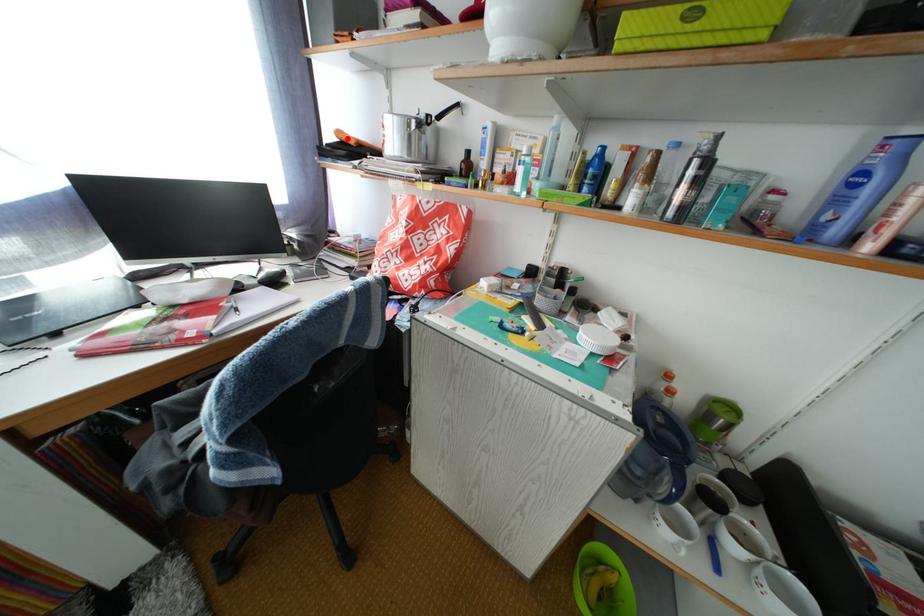
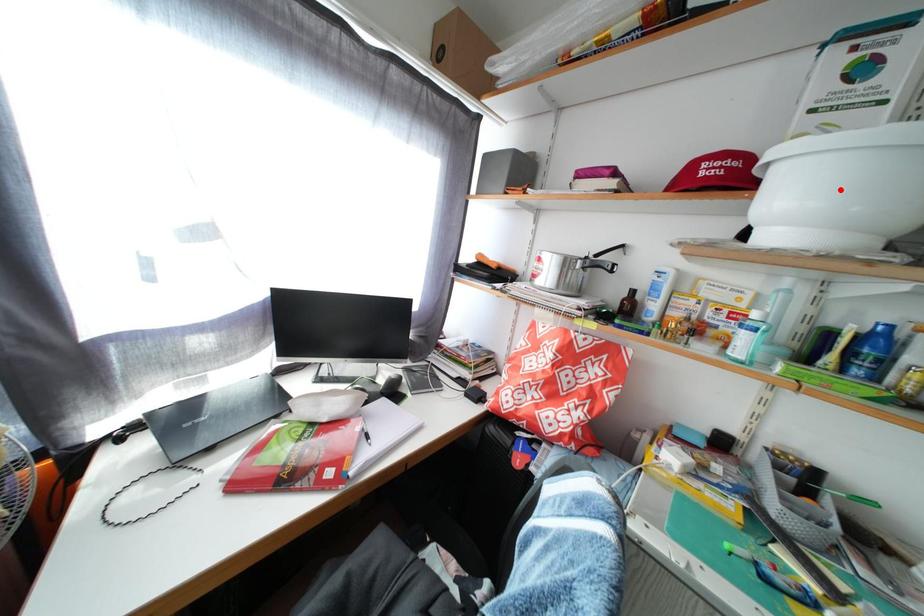
I am providing you with two images of the same scene from different viewpoints. A red point is marked on the first image and another point is marked on the second image. Is the red point in image1 aligned with the point shown in image2?

No